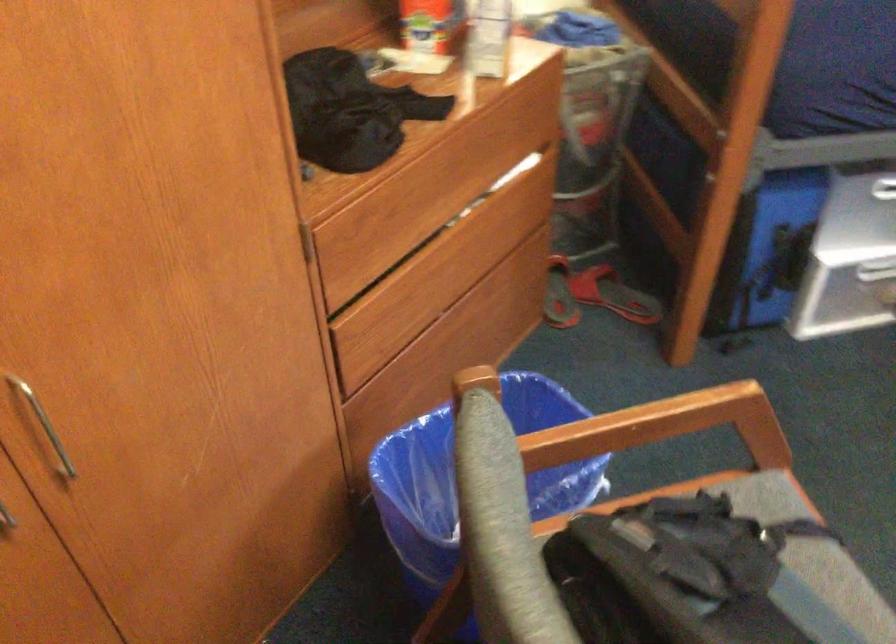
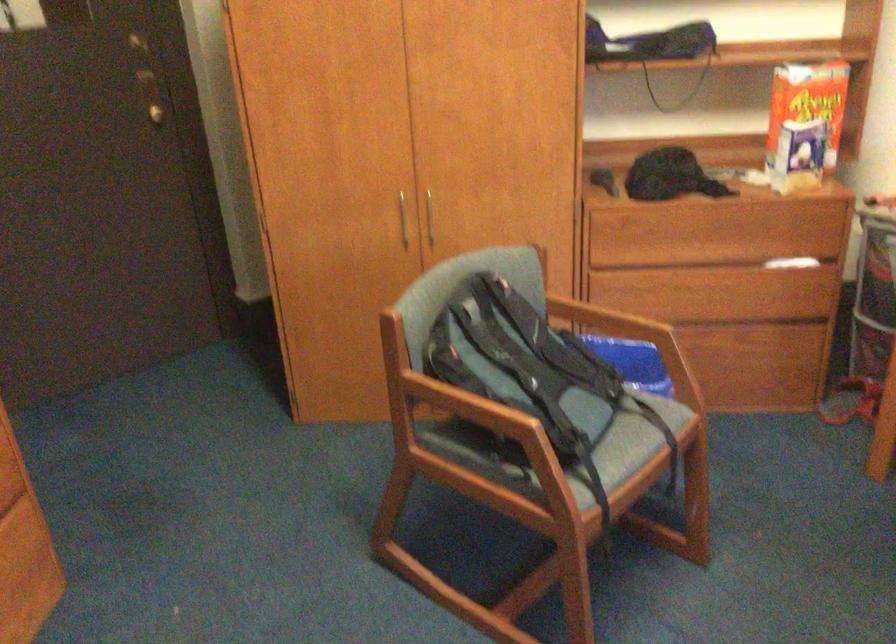
The point at [443,263] is marked in the first image. Where is the corresponding point in the second image?

(700, 290)